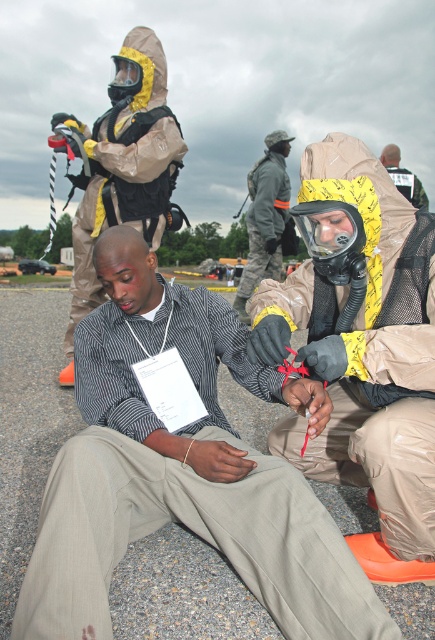
Question: Which object is farther from the camera taking this photo?

Choices:
 (A) matte khaki suit at center
 (B) striped shirt at center
 (C) tan fabric helmet at upper center
 (D) matte black gas mask at upper center

Answer: (C)

Question: Is matte khaki suit at center to the left of camouflage fabric uniform at center from the viewer's perspective?

Choices:
 (A) yes
 (B) no

Answer: (A)

Question: From the image, what is the correct spatial relationship of striped shirt at center in relation to camouflage fabric uniform at center?

Choices:
 (A) right
 (B) left

Answer: (B)

Question: Which of the following is the closest to the observer?

Choices:
 (A) matte khaki suit at center
 (B) tan fabric helmet at upper center

Answer: (A)

Question: Is matte khaki suit at center wider than matte black gas mask at upper center?

Choices:
 (A) no
 (B) yes

Answer: (A)

Question: Which point appears farthest from the camera in this image?

Choices:
 (A) (237, 289)
 (B) (210, 392)
 (C) (395, 163)

Answer: (C)